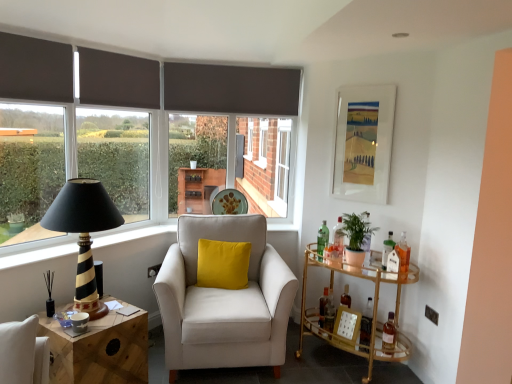
You are a GUI agent. You are given a task and a screenshot of the screen. Output one action in this format:
    pyautogui.click(x=<x>, y=<y>)
    Task: Click on the free space above black fabric window screen at left (from a real-world perspective)
    The width and height of the screenshot is (512, 384).
    Given the screenshot: What is the action you would take?
    [x=35, y=34]